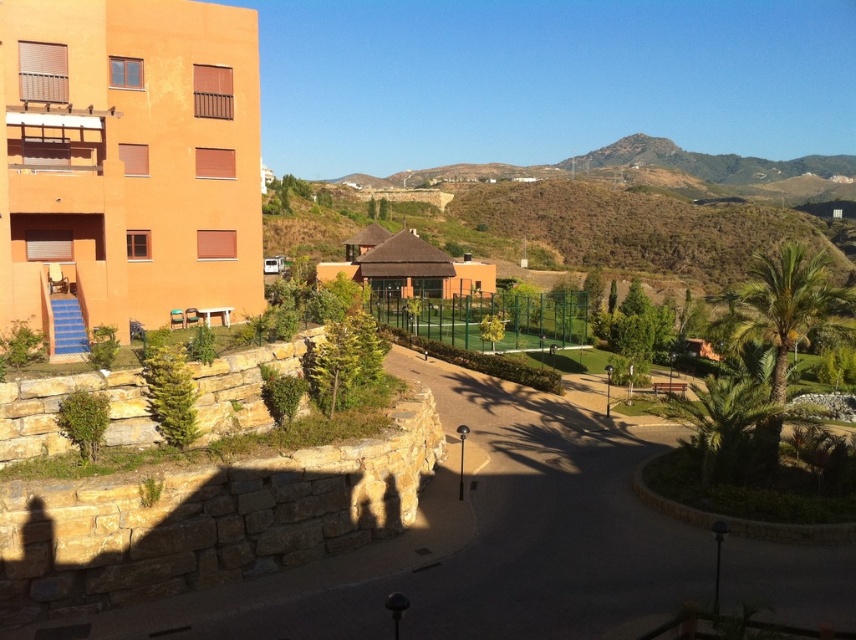
Does point (200, 90) come behind point (825, 328)?

Yes.

Does point (70, 218) lie in front of point (824, 312)?

No.

Find the location of a particular element. The width and height of the screenshot is (856, 640). orange stucco building at left is located at coordinates (128, 164).

In order to click on orange stucco building at left in this screenshot , I will do `click(128, 164)`.